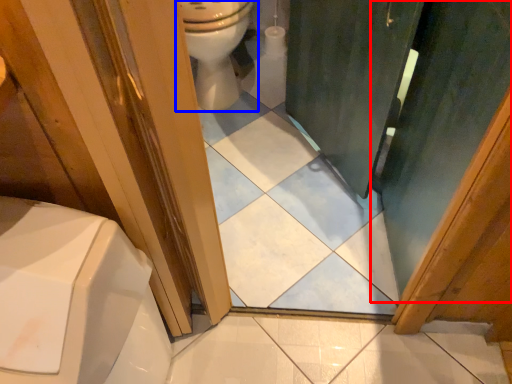
Question: Which of the following is the farthest to the observer, screen door (highlighted by a red box) or toilet (highlighted by a blue box)?

Choices:
 (A) screen door
 (B) toilet

Answer: (B)